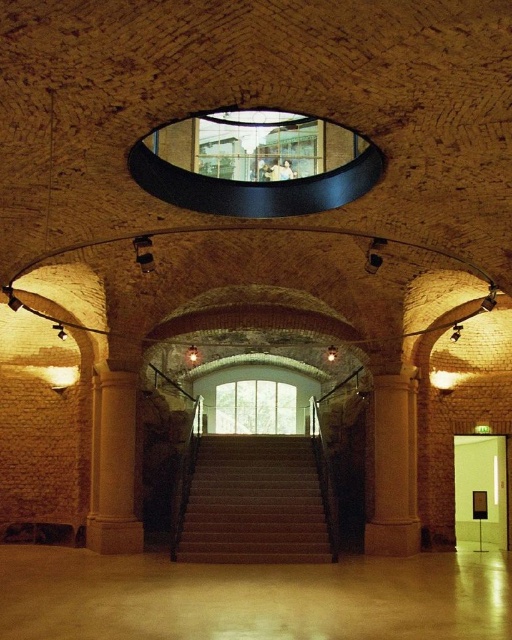
Question: Is sanded concrete floor at lower center thinner than smooth beige stairs at center?

Choices:
 (A) no
 (B) yes

Answer: (A)

Question: Is sanded concrete floor at lower center below smooth beige stairs at center?

Choices:
 (A) no
 (B) yes

Answer: (B)

Question: Which object appears closest to the camera in this image?

Choices:
 (A) smooth beige column at center
 (B) smooth beige stairs at center

Answer: (A)

Question: Estimate the real-world distances between objects in this image. Which object is farther from the sandy stone column at center?

Choices:
 (A) sanded concrete floor at lower center
 (B) smooth beige stairs at center
 (C) smooth beige column at center

Answer: (C)

Question: Which is farther from the smooth beige column at center?

Choices:
 (A) sanded concrete floor at lower center
 (B) smooth beige stairs at center

Answer: (B)

Question: Is sanded concrete floor at lower center thinner than smooth beige column at center?

Choices:
 (A) no
 (B) yes

Answer: (A)